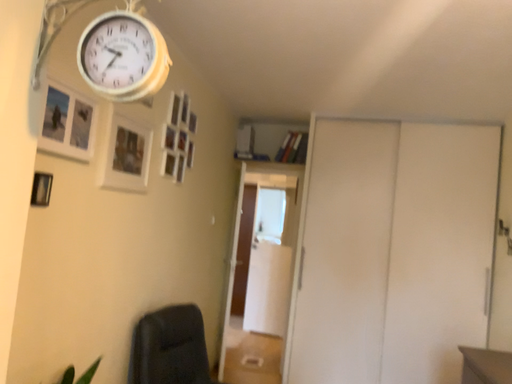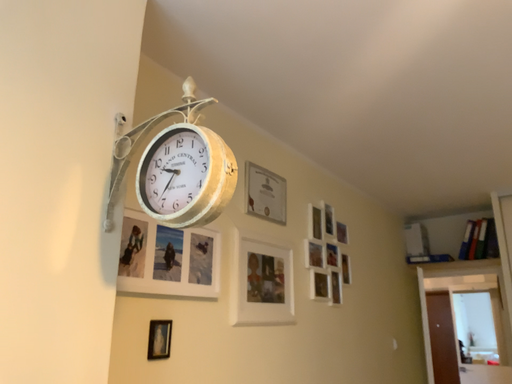
Question: Which way did the camera rotate in the video?

Choices:
 (A) rotated downward
 (B) rotated upward

Answer: (B)